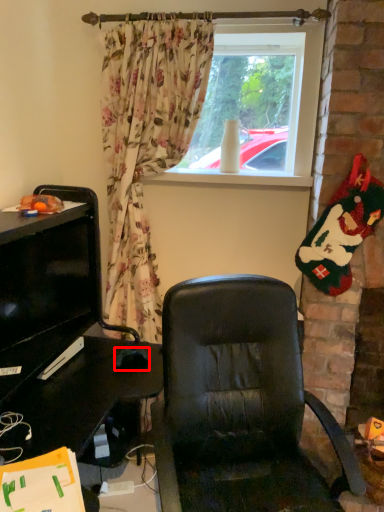
Question: From the image, what is the correct spatial relationship of mouse (annotated by the red box) in relation to window screen?

Choices:
 (A) right
 (B) left

Answer: (B)